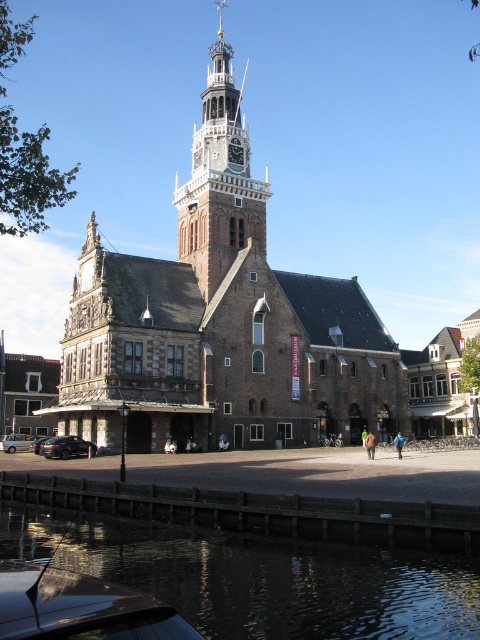
From the picture: Does brown brick church at center have a lesser height compared to dark reflective water at lower left?

No.

This screenshot has height=640, width=480. What are the coordinates of `brown brick church at center` in the screenshot? It's located at (222, 321).

Who is more distant from viewer, (222, 278) or (223, 227)?

The point (223, 227) is behind.

Is point (277, 388) closer to viewer compared to point (193, 214)?

Yes, point (277, 388) is closer to viewer.

Who is more forward, (70, 364) or (206, 209)?

Positioned in front is point (70, 364).

Where is `brown brick church at center`? The width and height of the screenshot is (480, 640). brown brick church at center is located at coordinates (222, 321).

Between point (421, 566) and point (214, 163), which one is positioned behind?

Point (214, 163)

Is dark reflective water at lower left positioned at the back of wooden clock tower at center?

No, it is not.

Who is more forward, (289, 618) or (184, 204)?

Positioned in front is point (289, 618).

Identify the location of dark reflective water at lower left. This screenshot has width=480, height=640. (260, 577).